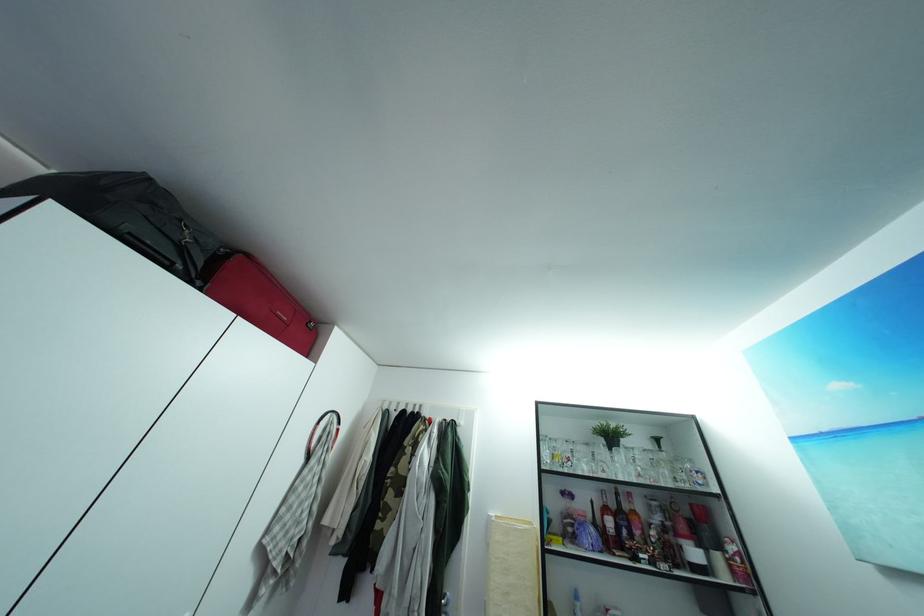
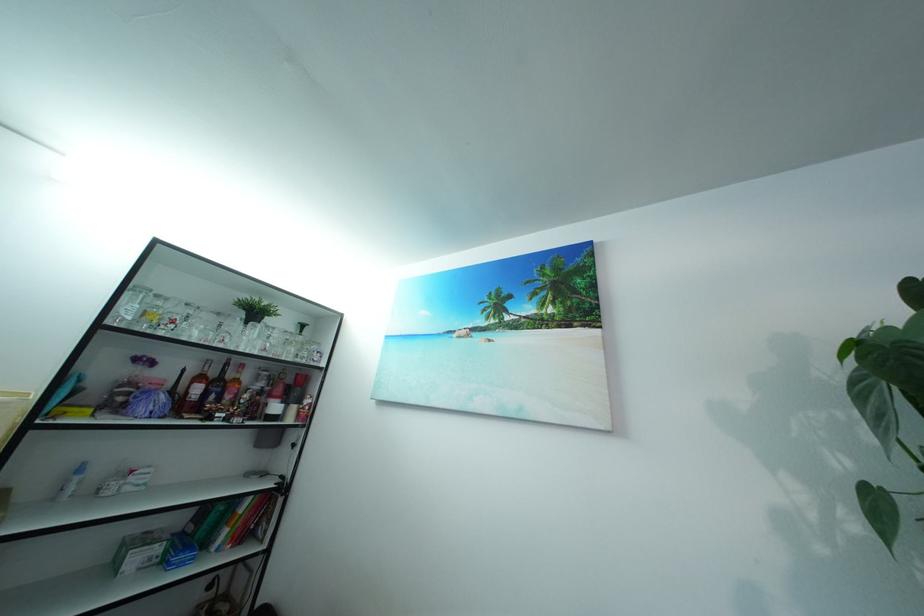
Where in the second image is the point corresponding to pixel 629 523 from the first image?

(226, 391)